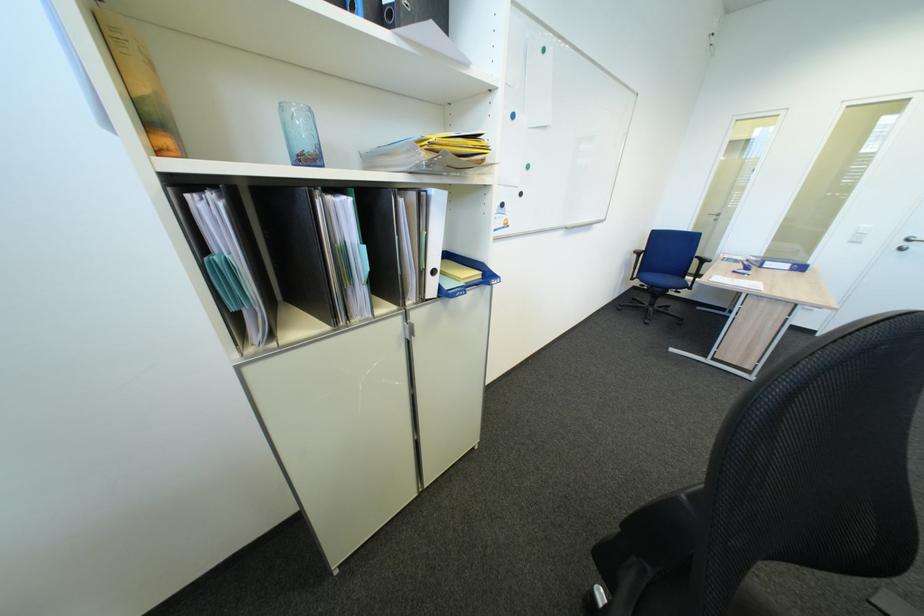
Image resolution: width=924 pixels, height=616 pixels. Describe the element at coordinates (908, 241) in the screenshot. I see `a door handle` at that location.